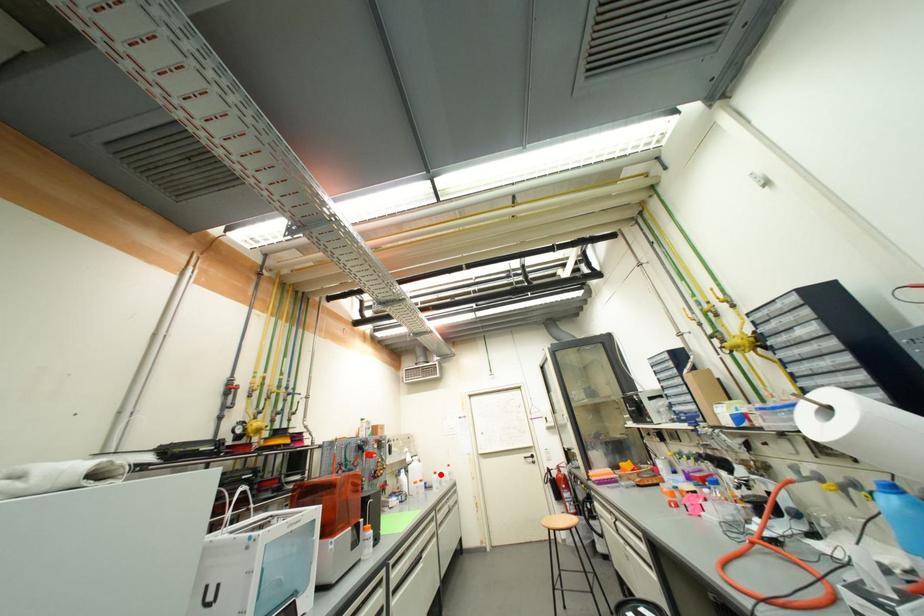
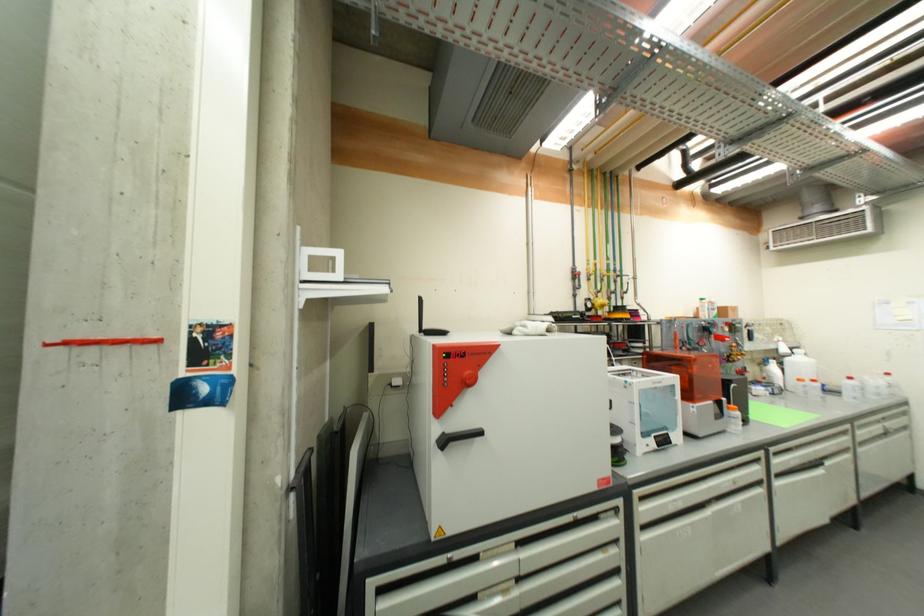
Question: I am providing you with two images of the same scene from different viewpoints. Given a red point in image1, look at the same physical point in image2. Is it:

Choices:
 (A) Closer to the viewpoint
 (B) Farther from the viewpoint

Answer: (A)